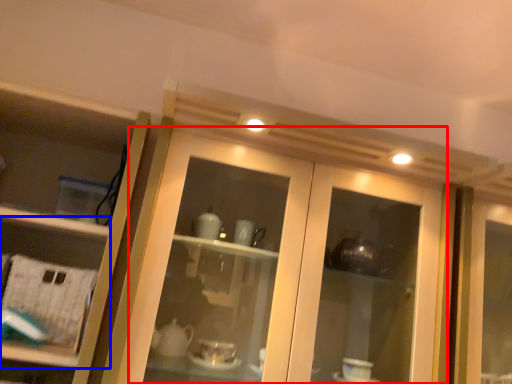
Question: Among these objects, which one is nearest to the camera, door (highlighted by a red box) or shelf (highlighted by a blue box)?

Choices:
 (A) door
 (B) shelf

Answer: (A)